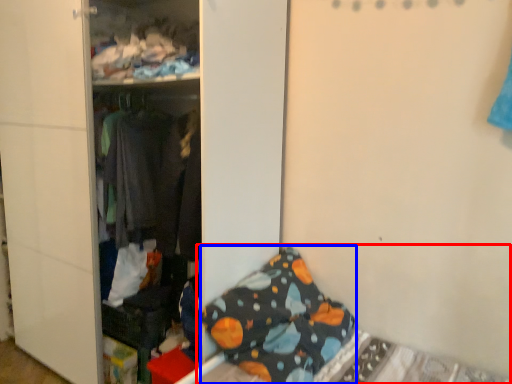
Question: Which of the following is the closest to the observer, bed (highlighted by a red box) or pillow (highlighted by a blue box)?

Choices:
 (A) bed
 (B) pillow

Answer: (A)